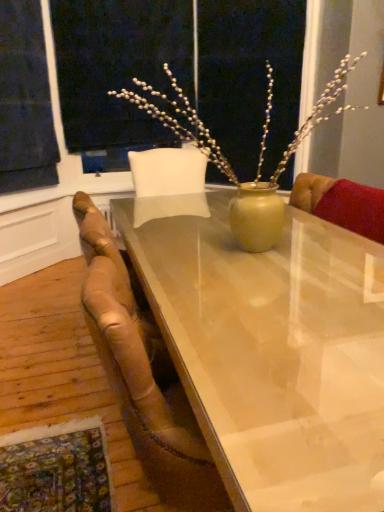
Question: Based on their positions, is leather at left located to the left or right of dark blue fabric at upper left?

Choices:
 (A) left
 (B) right

Answer: (B)

Question: Is leather at left taller or shorter than dark blue fabric at upper left?

Choices:
 (A) short
 (B) tall

Answer: (A)

Question: Considering the real-world distances, which object is closest to the translucent glass table at center?

Choices:
 (A) leather at left
 (B) dark blue fabric at upper left

Answer: (A)

Question: Based on their relative distances, which object is nearer to the dark blue fabric at upper left?

Choices:
 (A) leather at left
 (B) translucent glass table at center

Answer: (A)